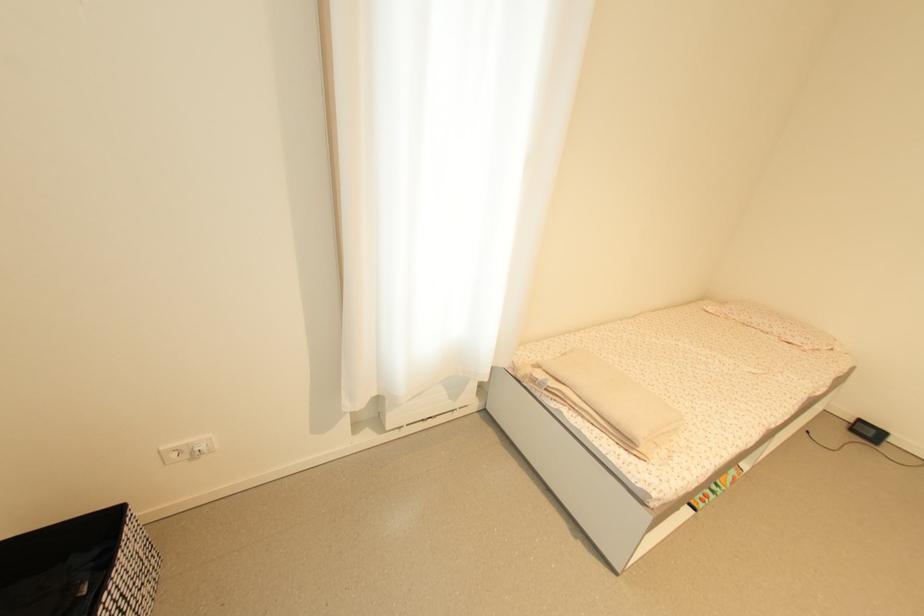
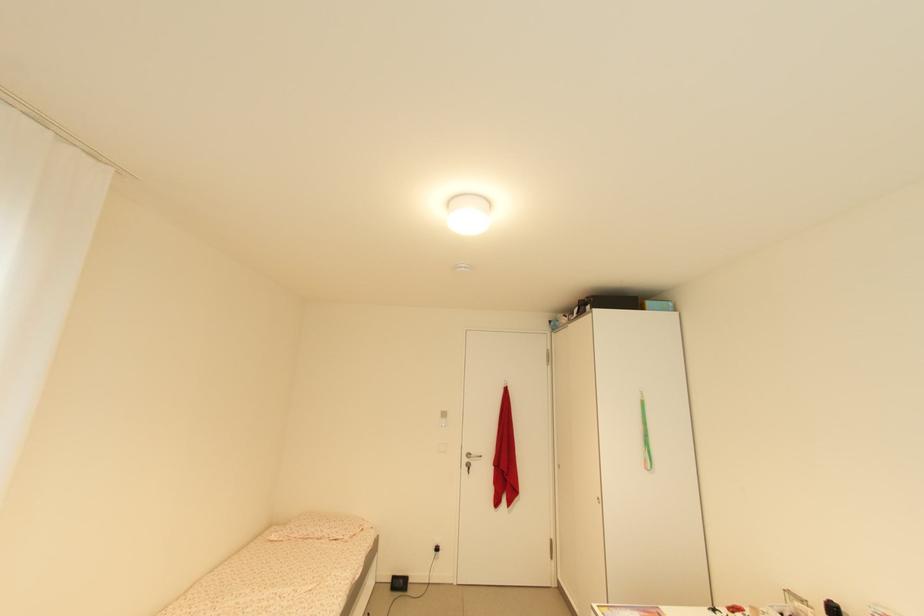
The images are taken continuously from a first-person perspective. In which direction is your viewpoint rotating?

The camera rotated toward right-up.